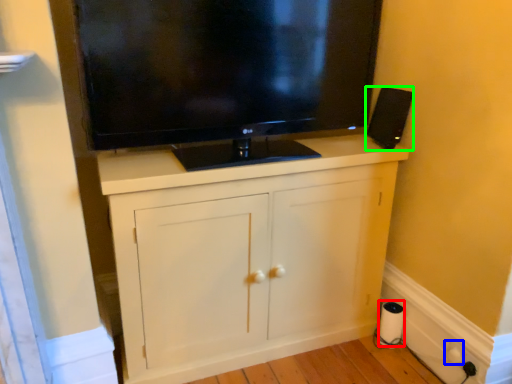
Question: Which is nearer to the paper towel (highlighted by a red box)? electric outlet (highlighted by a blue box) or loudspeaker (highlighted by a green box).

Choices:
 (A) electric outlet
 (B) loudspeaker

Answer: (A)